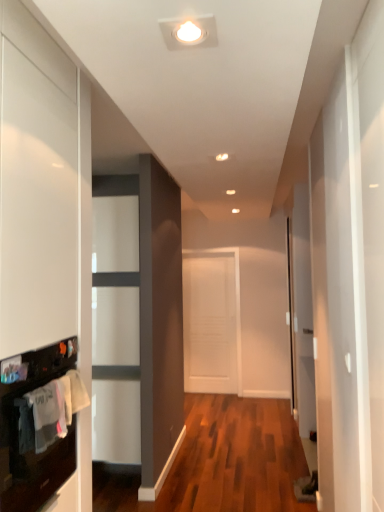
Question: Is point (77, 381) positioned closer to the camera than point (14, 362)?

Choices:
 (A) closer
 (B) farther

Answer: (B)

Question: From a real-world perspective, is white cotton laundry at left positioned above or below black glossy oven at lower left?

Choices:
 (A) below
 (B) above

Answer: (B)

Question: Which object is the farthest from the white matte door at center?

Choices:
 (A) white cotton laundry at left
 (B) black glossy oven at lower left

Answer: (A)

Question: Which of these objects is positioned farthest from the black glossy oven at lower left?

Choices:
 (A) white cotton laundry at left
 (B) white matte door at center

Answer: (B)